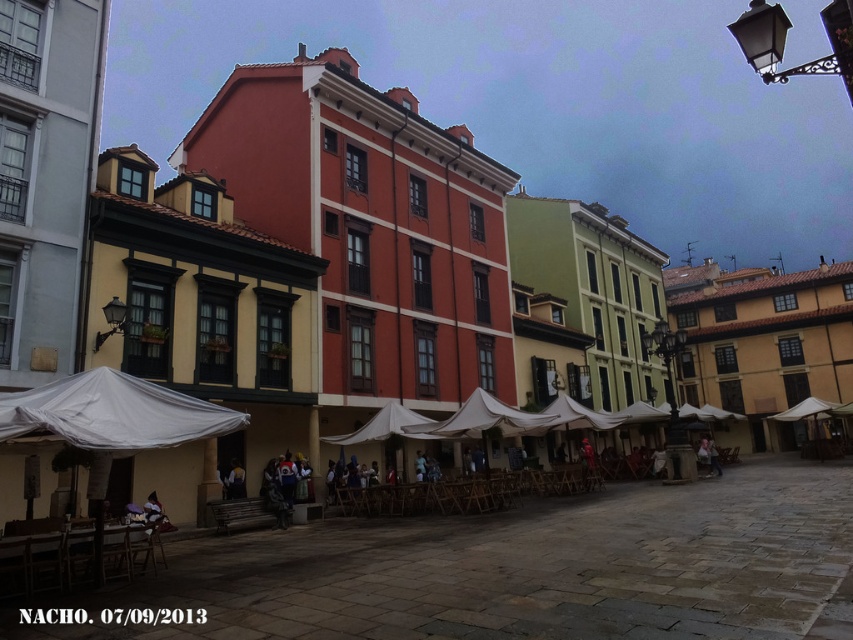
Question: Is white fabric canopy at center further to the viewer compared to leather jacket at center?

Choices:
 (A) yes
 (B) no

Answer: (B)

Question: Which point is closer to the camera?

Choices:
 (A) leather jacket at center
 (B) white fabric canopy at center
 (C) white fabric canopy at lower left

Answer: (C)

Question: Can you confirm if white fabric canopy at lower left is positioned to the right of leather jacket at center?

Choices:
 (A) no
 (B) yes

Answer: (A)

Question: Can you confirm if white fabric canopy at center is wider than leather jacket at center?

Choices:
 (A) yes
 (B) no

Answer: (B)

Question: Based on their relative distances, which object is farther from the leather jacket at center?

Choices:
 (A) white fabric canopy at lower left
 (B) white fabric canopy at center

Answer: (A)

Question: Estimate the real-world distances between objects in this image. Which object is closer to the leather jacket at center?

Choices:
 (A) white fabric canopy at lower left
 (B) white fabric canopy at center

Answer: (B)